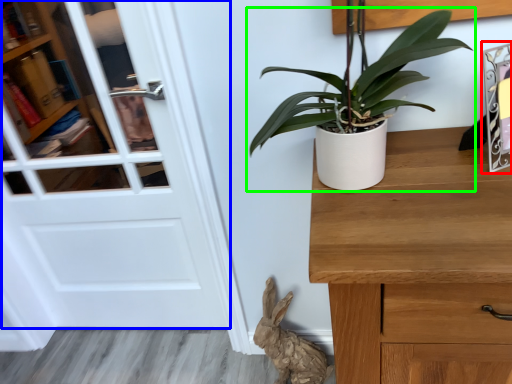
Question: Considering the real-world distances, which object is farthest from picture frame (highlighted by a red box)? door (highlighted by a blue box) or houseplant (highlighted by a green box)?

Choices:
 (A) door
 (B) houseplant

Answer: (A)